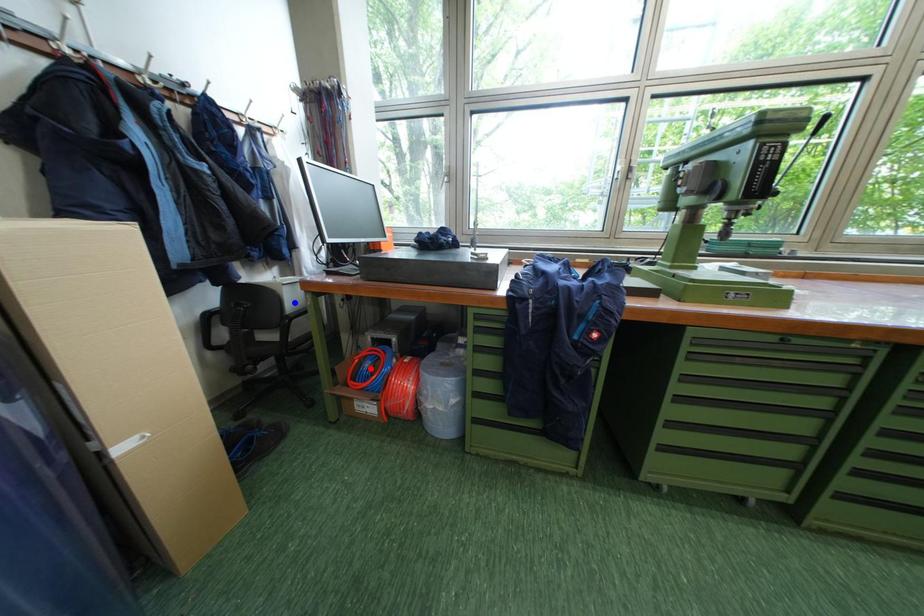
Question: In the image, two points are highlighted. Which point is nearer to the camera? Reply with the corresponding letter.

Choices:
 (A) blue point
 (B) red point

Answer: (A)